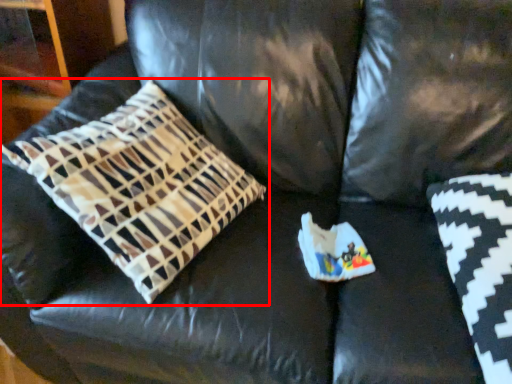
Question: Considering the relative positions of pillow (annotated by the red box) and pillow in the image provided, where is pillow (annotated by the red box) located with respect to the staircase?

Choices:
 (A) right
 (B) left

Answer: (B)